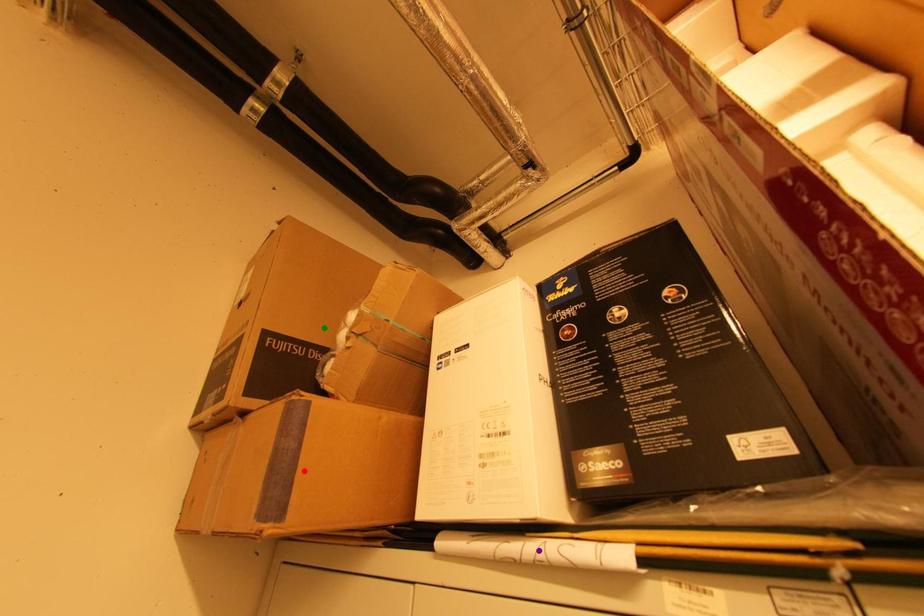
Order these from nearest to farthest:
A) red point
B) purple point
C) green point

purple point → red point → green point